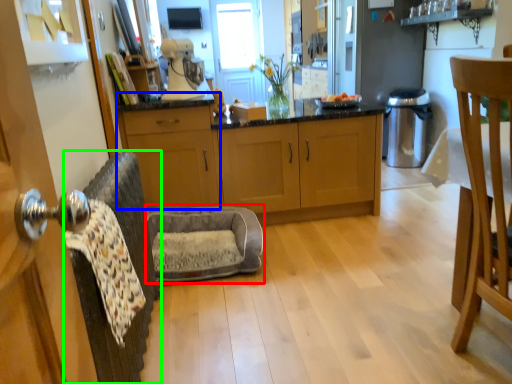
Question: Based on their relative distances, which object is nearer to swivel chair (highlighted by a red box)? Choose from cabinetry (highlighted by a blue box) and swivel chair (highlighted by a green box).

Choices:
 (A) cabinetry
 (B) swivel chair

Answer: (A)